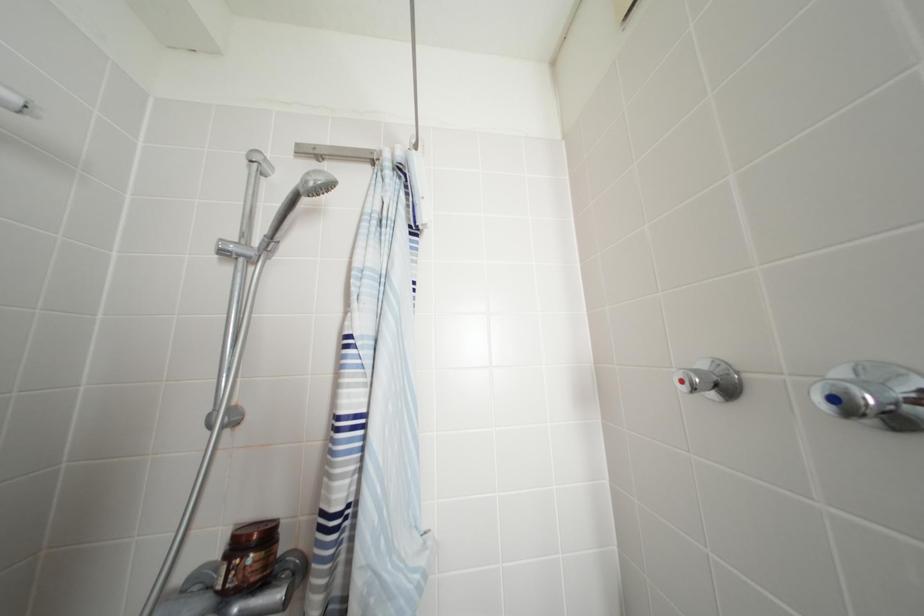
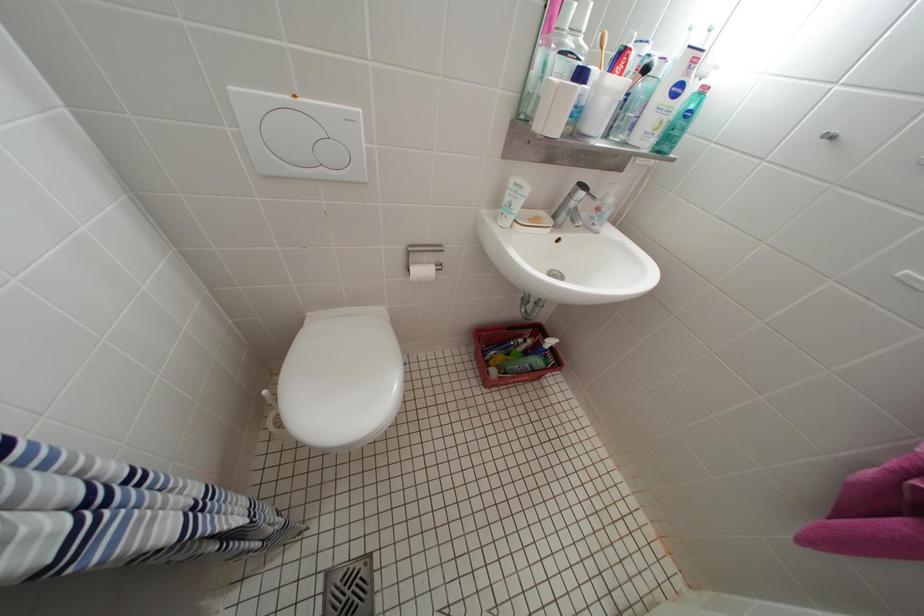
First-person continuous shooting, in which direction is the camera rotating?

The camera's rotation is toward right-down.